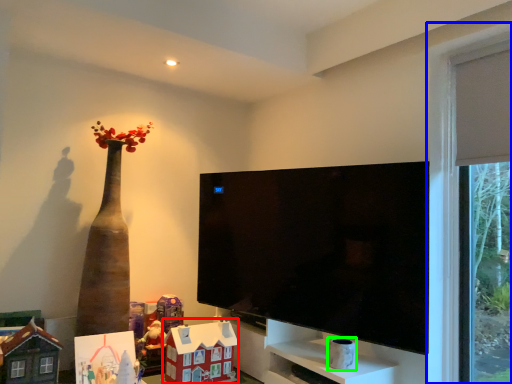
Question: Which object is the closest to the toy (highlighted by a red box)? Choose among these: window (highlighted by a blue box) or toy (highlighted by a green box).

Choices:
 (A) window
 (B) toy

Answer: (B)